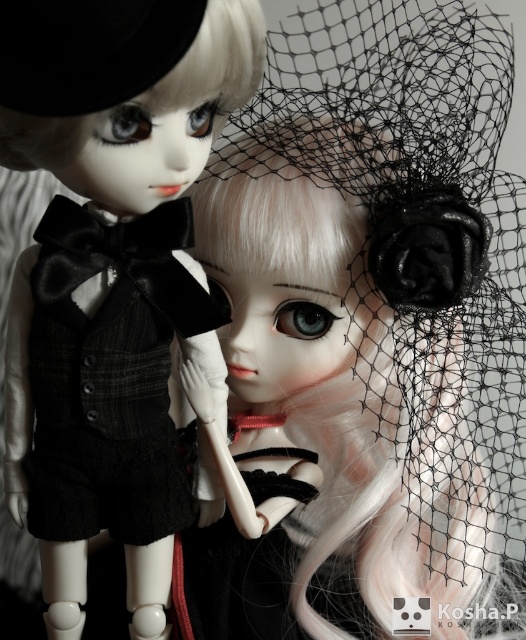
Does satin black doll at center have a smaller size compared to matte black veil at upper right?

Actually, satin black doll at center might be larger than matte black veil at upper right.

Can you confirm if satin black doll at center is bigger than matte black veil at upper right?

Yes.

Where is `satin black doll at center`? The height and width of the screenshot is (640, 526). satin black doll at center is located at coordinates (369, 333).

Does velvet black vest at left have a greater width compared to black velvet hat at upper left?

Yes, velvet black vest at left is wider than black velvet hat at upper left.

Who is more forward, (86, 260) or (135, 22)?

Point (135, 22) is more forward.

Is point (114, 237) behind point (129, 61)?

Yes.

Find the location of a particular element. This screenshot has width=526, height=640. velvet black vest at left is located at coordinates (110, 374).

Can you confirm if satin black doll at center is positioned to the right of black velvet hat at upper left?

Yes, satin black doll at center is to the right of black velvet hat at upper left.

Does satin black doll at center have a lesser width compared to black velvet hat at upper left?

Incorrect, satin black doll at center's width is not less than black velvet hat at upper left's.

At what (x,y) coordinates should I click in order to perform the action: click on satin black doll at center. Please return your answer as a coordinate pair (x, y). The image size is (526, 640). Looking at the image, I should click on (369, 333).